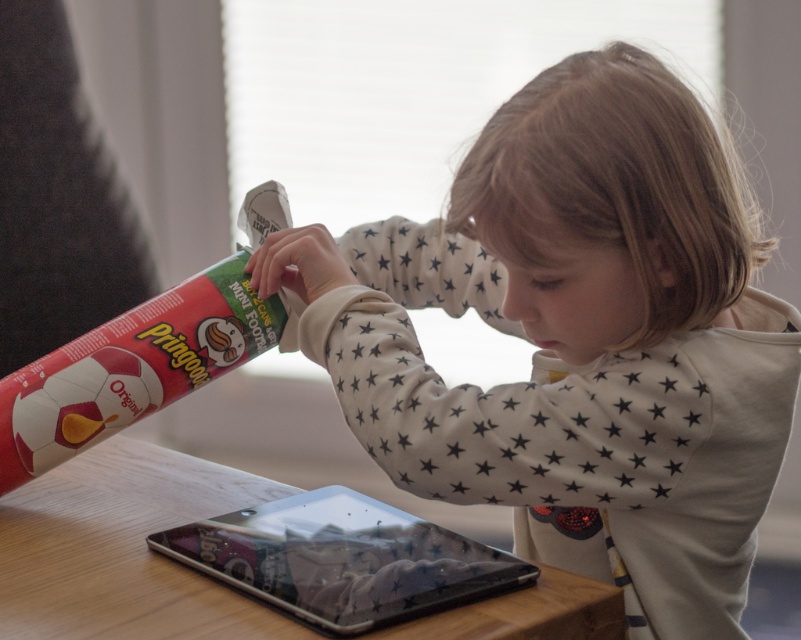
What do you see at coordinates (123, 548) in the screenshot? Image resolution: width=801 pixels, height=640 pixels. I see `wooden table at center` at bounding box center [123, 548].

Between wooden table at center and transparent plastic tablet at center, which one appears on the left side from the viewer's perspective?

From the viewer's perspective, wooden table at center appears more on the left side.

Does point (13, 518) come farther from viewer compared to point (212, 532)?

Yes, it is behind point (212, 532).

Image resolution: width=801 pixels, height=640 pixels. Identify the location of wooden table at center. point(123,548).

Does matte red pringles can at left have a lesser height compared to transparent plastic tablet at center?

No.

The height and width of the screenshot is (640, 801). What are the coordinates of `matte red pringles can at left` in the screenshot? It's located at (141, 356).

Where is `matte red pringles can at left`? matte red pringles can at left is located at coordinates (141, 356).

Can you confirm if white star-patterned sweater at center is bigger than matte red pringles can at left?

Yes.

Measure the distance from white star-patterned sweater at center to matte red pringles can at left.

white star-patterned sweater at center and matte red pringles can at left are 28.75 centimeters apart from each other.

Image resolution: width=801 pixels, height=640 pixels. I want to click on white star-patterned sweater at center, so click(578, 339).

Locate an element on the screen. white star-patterned sweater at center is located at coordinates (578, 339).